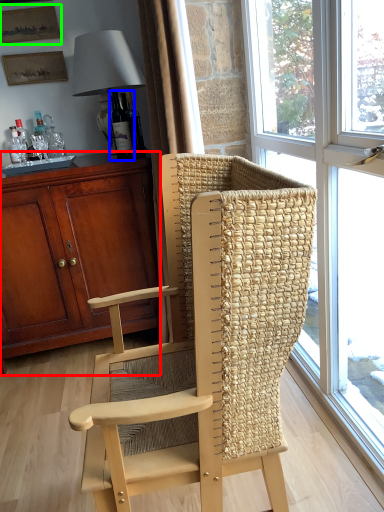
Question: Which object is the farthest from cabinetry (highlighted by a red box)? Choose among these: bottle (highlighted by a blue box) or picture frame (highlighted by a green box).

Choices:
 (A) bottle
 (B) picture frame

Answer: (B)